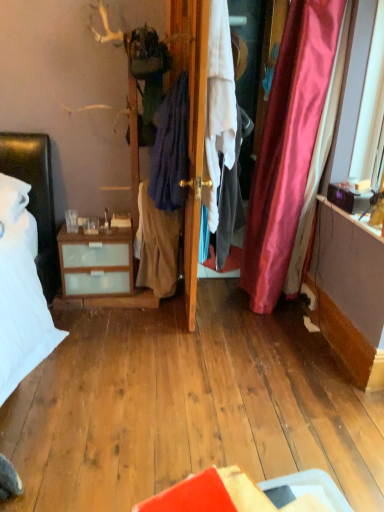
Question: Considering the positions of point (193, 102) and point (220, 194), is point (193, 102) closer or farther from the camera than point (220, 194)?

Choices:
 (A) closer
 (B) farther

Answer: (A)

Question: From the image's perspective, relative to white cotton shirt at center, the first clothing when ordered from right to left, is white fabric screen door at center above or below?

Choices:
 (A) above
 (B) below

Answer: (A)

Question: Estimate the real-world distances between objects in this image. Which object is farther from the beige cotton skirt at center, positioned as the third clothing in right-to-left order?

Choices:
 (A) dark blue fabric at center, the second clothing in the right-to-left sequence
 (B) white fabric screen door at center
 (C) wooden door at center
 (D) white cotton shirt at center, the first clothing when ordered from right to left

Answer: (B)

Question: Based on their relative distances, which object is nearer to the wooden door at center?

Choices:
 (A) white cotton shirt at center, the first clothing when ordered from right to left
 (B) dark blue fabric at center, the second clothing in the right-to-left sequence
 (C) beige cotton skirt at center, which is the first clothing in left-to-right order
 (D) white fabric screen door at center

Answer: (D)